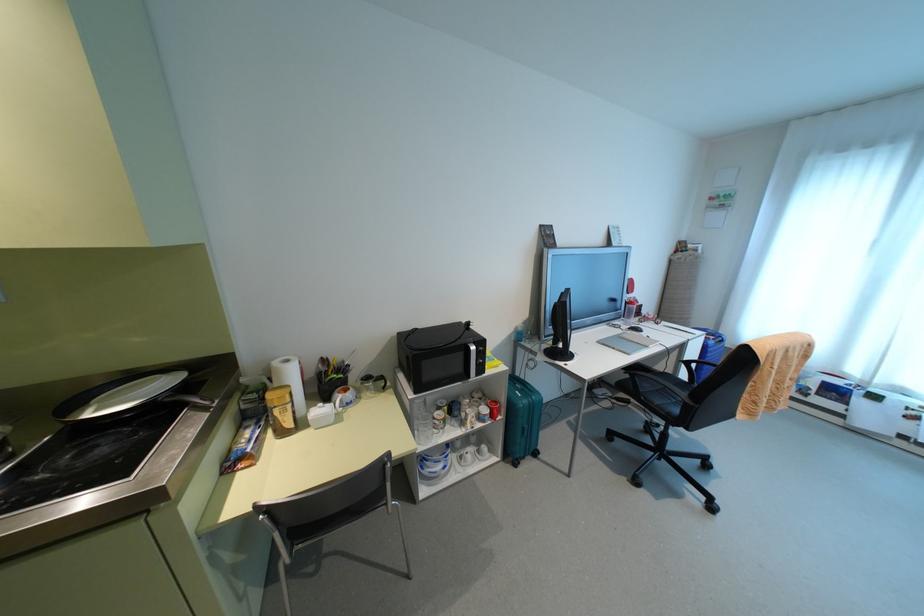
This screenshot has height=616, width=924. I want to click on tall drinking glass, so click(421, 423).